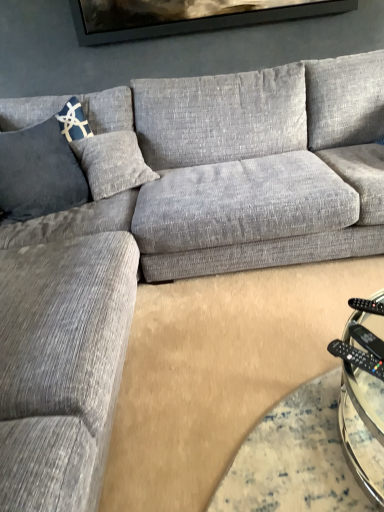
This screenshot has width=384, height=512. Describe the element at coordinates (109, 109) in the screenshot. I see `blue textured pillow at left` at that location.

The image size is (384, 512). Describe the element at coordinates (357, 358) in the screenshot. I see `black plastic remote at lower right` at that location.

Measure the distance between black plastic remote at lower right and camera.

They are 1.03 meters apart.

You are a GUI agent. You are given a task and a screenshot of the screen. Output one action in this format:
    pyautogui.click(x=<x>, y=<y>)
    Task: Click on the black plastic remote at lower right, placed as the 2th remote when sorted from top to bottom
    The height and width of the screenshot is (512, 384).
    Given the screenshot: What is the action you would take?
    pyautogui.click(x=367, y=340)

I want to click on remote in front of the black plastic remote at lower right, acting as the 1th remote starting from the top, so click(x=367, y=340).

Is black plastic remote at lower right, the second remote positioned from the bottom, not close to black plastic remote at lower right, which is counted as the 2th remote, starting from the back?

No.

From the image's perspective, does black plastic remote at lower right, arranged as the first remote when viewed from the back, appear lower than black plastic remote at lower right, which is counted as the 2th remote, starting from the back?

Incorrect, from the image's perspective, black plastic remote at lower right, arranged as the first remote when viewed from the back, is higher than black plastic remote at lower right, which is counted as the 2th remote, starting from the back.

Does black plastic remote at lower right, the second remote positioned from the bottom, have a larger size compared to black plastic remote at lower right, which is counted as the first remote, starting from the front?

Correct, black plastic remote at lower right, the second remote positioned from the bottom, is larger in size than black plastic remote at lower right, which is counted as the first remote, starting from the front.

Is black plastic remote at lower right, which ranks as the 2th remote in front-to-back order, at the back of black plastic remote at lower right?

black plastic remote at lower right is not turned away from black plastic remote at lower right, which ranks as the 2th remote in front-to-back order.

Which is closer to the camera, (377,366) or (377,313)?

Point (377,366)

Is black plastic remote at lower right bigger or smaller than black plastic remote at lower right, acting as the 1th remote starting from the top?

black plastic remote at lower right is bigger than black plastic remote at lower right, acting as the 1th remote starting from the top.

Is black plastic remote at lower right positioned beyond the bounds of black plastic remote at lower right, acting as the 1th remote starting from the top?

Yes, black plastic remote at lower right is not within black plastic remote at lower right, acting as the 1th remote starting from the top.

Considering the relative sizes of black plastic remote at lower right, which is counted as the 2th remote, starting from the back, and blue textured pillow at left in the image provided, is black plastic remote at lower right, which is counted as the 2th remote, starting from the back, wider than blue textured pillow at left?

No.

Considering the relative positions of black plastic remote at lower right, which is counted as the first remote, starting from the front, and blue textured pillow at left in the image provided, is black plastic remote at lower right, which is counted as the first remote, starting from the front, in front of blue textured pillow at left?

Yes, it is in front of blue textured pillow at left.

Can you confirm if black plastic remote at lower right, which is counted as the 2th remote, starting from the back, is taller than blue textured pillow at left?

Incorrect, the height of black plastic remote at lower right, which is counted as the 2th remote, starting from the back, is not larger of that of blue textured pillow at left.

Can you confirm if black plastic remote at lower right, which is counted as the first remote, starting from the front, is positioned to the right of blue textured pillow at left?

Correct, you'll find black plastic remote at lower right, which is counted as the first remote, starting from the front, to the right of blue textured pillow at left.

Is black plastic remote at lower right surrounded by black plastic remote at lower right, which is counted as the 2th remote, starting from the back?

No, black plastic remote at lower right is not surrounded by black plastic remote at lower right, which is counted as the 2th remote, starting from the back.

Who is shorter, black plastic remote at lower right, which is counted as the first remote, starting from the front, or black plastic remote at lower right?

With less height is black plastic remote at lower right.

How distant is black plastic remote at lower right, placed as the 2th remote when sorted from top to bottom, from black plastic remote at lower right?

black plastic remote at lower right, placed as the 2th remote when sorted from top to bottom, is 1.72 inches away from black plastic remote at lower right.

From a real-world perspective, is black plastic remote at lower right, which is counted as the 2th remote, starting from the back, positioned above or below black plastic remote at lower right?

black plastic remote at lower right, which is counted as the 2th remote, starting from the back, is below black plastic remote at lower right.

The width and height of the screenshot is (384, 512). What are the coordinates of `control that appears on the left of black plastic remote at lower right, arranged as the first remote when viewed from the back` in the screenshot? It's located at (357, 358).

Is black plastic remote at lower right, the second remote positioned from the bottom, positioned behind black plastic remote at lower right?

Yes.

From the image's perspective, which object appears higher, black plastic remote at lower right, acting as the 1th remote starting from the top, or black plastic remote at lower right?

black plastic remote at lower right, acting as the 1th remote starting from the top, is shown above in the image.

Which of these two, black plastic remote at lower right, acting as the 1th remote starting from the top, or black plastic remote at lower right, is bigger?

black plastic remote at lower right is bigger.

Image resolution: width=384 pixels, height=512 pixels. I want to click on control located in front of the blue textured pillow at left, so click(357, 358).

Between point (377, 360) and point (99, 99), which one is positioned in front?

The point (377, 360) is closer to the camera.

Does black plastic remote at lower right have a larger size compared to blue textured pillow at left?

No.

From a real-world perspective, is black plastic remote at lower right physically above blue textured pillow at left?

Incorrect, from a real-world perspective, black plastic remote at lower right is lower than blue textured pillow at left.

Is black plastic remote at lower right, the second remote positioned from the bottom, surrounded by black plastic remote at lower right, which is the first remote from bottom to top?

Actually, black plastic remote at lower right, the second remote positioned from the bottom, is outside black plastic remote at lower right, which is the first remote from bottom to top.

From a real-world perspective, between black plastic remote at lower right, which is counted as the 2th remote, starting from the back, and black plastic remote at lower right, the second remote positioned from the bottom, who is vertically lower?

In real-world perspective, black plastic remote at lower right, which is counted as the 2th remote, starting from the back, is lower.

Is black plastic remote at lower right, placed as the 2th remote when sorted from top to bottom, placed right next to black plastic remote at lower right, acting as the 1th remote starting from the top?

Yes, black plastic remote at lower right, placed as the 2th remote when sorted from top to bottom, is right next to black plastic remote at lower right, acting as the 1th remote starting from the top, and making contact.

From the image's perspective, is black plastic remote at lower right, placed as the 2th remote when sorted from top to bottom, positioned above or below black plastic remote at lower right, the second remote positioned from the bottom?

From the image's perspective, black plastic remote at lower right, placed as the 2th remote when sorted from top to bottom, appears below black plastic remote at lower right, the second remote positioned from the bottom.

Find the location of a particular element. This screenshot has width=384, height=512. remote lying in front of the black plastic remote at lower right, which ranks as the 2th remote in front-to-back order is located at coordinates (367, 340).

The height and width of the screenshot is (512, 384). Identify the location of remote that is the 2nd one when counting rightward from the black plastic remote at lower right. (367, 306).

Based on the photo, estimate the real-world distances between objects in this image. Which object is further from black plastic remote at lower right, blue textured pillow at left or black plastic remote at lower right, which is the first remote from bottom to top?

Based on the image, blue textured pillow at left appears to be further to black plastic remote at lower right.

From the image, which object appears to be farther from blue textured pillow at left, black plastic remote at lower right or black plastic remote at lower right, acting as the 1th remote starting from the top?

black plastic remote at lower right is further to blue textured pillow at left.

Estimate the real-world distances between objects in this image. Which object is closer to black plastic remote at lower right, black plastic remote at lower right, arranged as the first remote when viewed from the back, or blue textured pillow at left?

Based on the image, black plastic remote at lower right, arranged as the first remote when viewed from the back, appears to be nearer to black plastic remote at lower right.

When comparing their distances from black plastic remote at lower right, placed as the 2th remote when sorted from top to bottom, does black plastic remote at lower right, the second remote positioned from the bottom, or black plastic remote at lower right seem closer?

black plastic remote at lower right lies closer to black plastic remote at lower right, placed as the 2th remote when sorted from top to bottom, than the other object.

From the picture: Considering their positions, is black plastic remote at lower right, which ranks as the 2th remote in front-to-back order, positioned closer to black plastic remote at lower right than black plastic remote at lower right, which is counted as the first remote, starting from the front?

The object closer to black plastic remote at lower right is black plastic remote at lower right, which is counted as the first remote, starting from the front.

From the picture: Estimate the real-world distances between objects in this image. Which object is closer to black plastic remote at lower right, which is the first remote from bottom to top, black plastic remote at lower right or black plastic remote at lower right, the second remote positioned from the bottom?

Based on the image, black plastic remote at lower right appears to be nearer to black plastic remote at lower right, which is the first remote from bottom to top.

Estimate the real-world distances between objects in this image. Which object is further from black plastic remote at lower right, arranged as the first remote when viewed from the back, blue textured pillow at left or black plastic remote at lower right, placed as the 2th remote when sorted from top to bottom?

blue textured pillow at left is positioned further to the anchor black plastic remote at lower right, arranged as the first remote when viewed from the back.

Looking at the image, which one is located closer to blue textured pillow at left, black plastic remote at lower right, which is the first remote from bottom to top, or black plastic remote at lower right?

Based on the image, black plastic remote at lower right, which is the first remote from bottom to top, appears to be nearer to blue textured pillow at left.

The image size is (384, 512). What are the coordinates of `control between blue textured pillow at left and black plastic remote at lower right, which is counted as the first remote, starting from the front, from left to right` in the screenshot? It's located at (357, 358).

Identify the location of remote between black plastic remote at lower right and black plastic remote at lower right, arranged as the first remote when viewed from the back, from front to back. The width and height of the screenshot is (384, 512). (367, 340).

Locate an element on the screen. The image size is (384, 512). control between blue textured pillow at left and black plastic remote at lower right, the second remote positioned from the bottom, in the horizontal direction is located at coordinates (357, 358).

At what (x,y) coordinates should I click in order to perform the action: click on remote between blue textured pillow at left and black plastic remote at lower right, the second remote positioned from the bottom, from left to right. Please return your answer as a coordinate pair (x, y). This screenshot has width=384, height=512. Looking at the image, I should click on (367, 340).